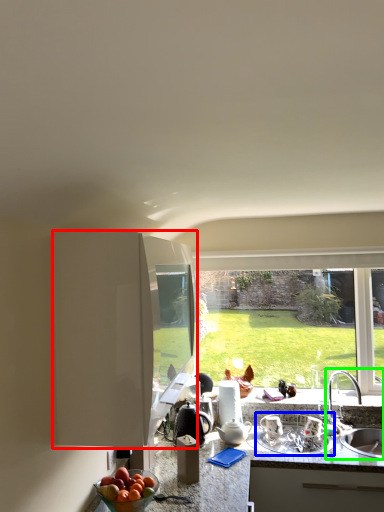
Question: Which object is positioned closest to cabinetry (highlighted by a red box)? Select from appliance (highlighted by a blue box) and sink (highlighted by a green box).

Choices:
 (A) appliance
 (B) sink

Answer: (A)